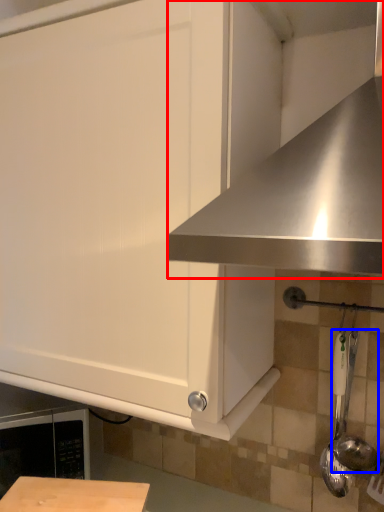
Question: Which of the following is the farthest to the observer, exhaust hood (highlighted by a red box) or utensil (highlighted by a blue box)?

Choices:
 (A) exhaust hood
 (B) utensil

Answer: (B)